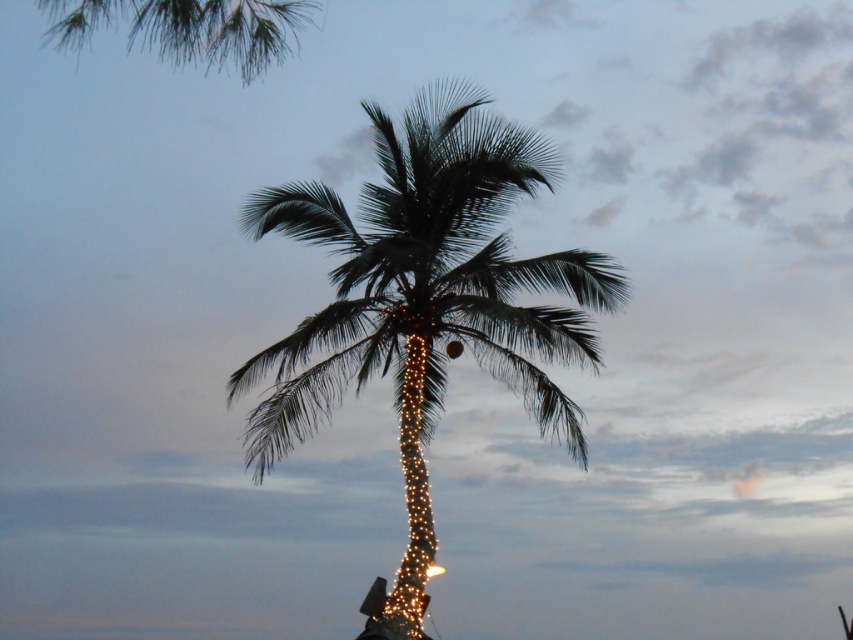
The width and height of the screenshot is (853, 640). Describe the element at coordinates (424, 304) in the screenshot. I see `green leafy palm tree at center` at that location.

Who is positioned more to the right, green leafy palm tree at center or green leafy palm at upper left?

Positioned to the right is green leafy palm tree at center.

This screenshot has width=853, height=640. In order to click on green leafy palm tree at center in this screenshot , I will do `click(424, 304)`.